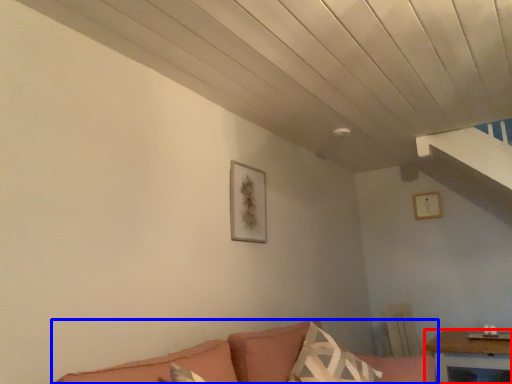
Question: Which object is further to the camera taking this photo, table (highlighted by a red box) or studio couch (highlighted by a blue box)?

Choices:
 (A) table
 (B) studio couch

Answer: (A)